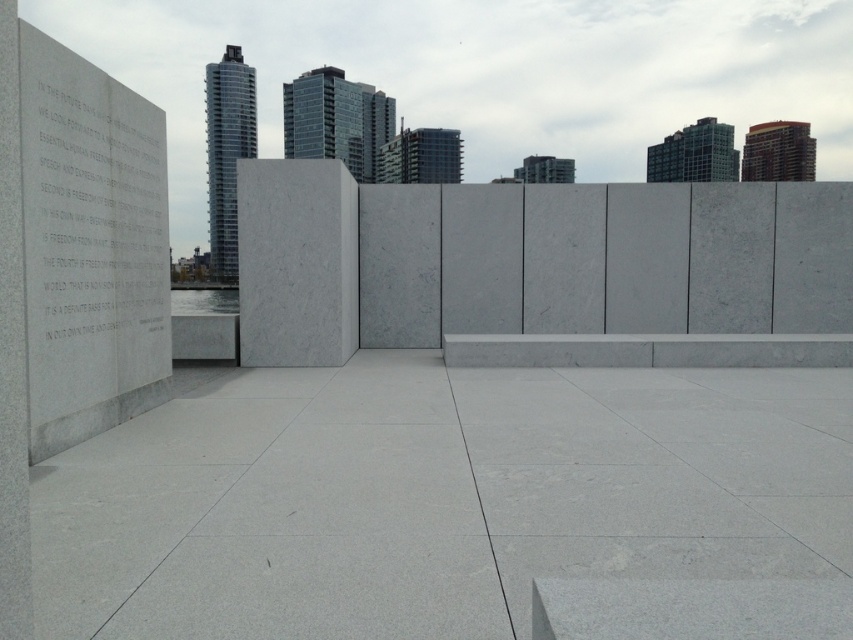
Question: Estimate the real-world distances between objects in this image. Which object is farther from the white marble plaque at left?

Choices:
 (A) white marble ledge at center
 (B) gray polished concrete at left

Answer: (B)

Question: Which point is farther to the camera?

Choices:
 (A) white marble plaque at left
 (B) white marble ledge at center
 (C) gray polished stone plaque at left

Answer: (B)

Question: Is white marble plaque at left thinner than white marble ledge at center?

Choices:
 (A) no
 (B) yes

Answer: (B)

Question: Which point is farther from the camera taking this photo?

Choices:
 (A) (643, 348)
 (B) (140, 269)
 (C) (138, 241)
 (D) (447, 596)

Answer: (A)

Question: Is gray polished concrete at left above white marble ledge at center?

Choices:
 (A) no
 (B) yes

Answer: (A)

Question: Does gray polished concrete at left lie behind gray polished stone plaque at left?

Choices:
 (A) no
 (B) yes

Answer: (A)